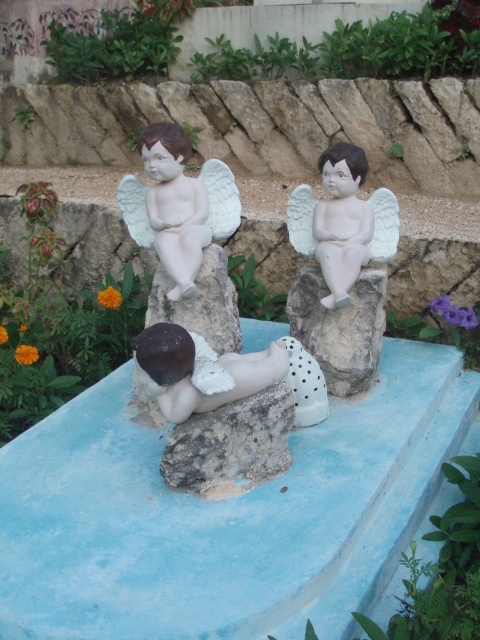
You are a sculptor examining the decorative arrangement. You need to determine if the white matte angel at center can be placed on top of the gray rough stone at center without exceeding its base. Based on their sizes, is this feasible?

The white matte angel at center has a larger size compared to gray rough stone at center, so placing it on top would not be feasible as the angel is bigger than the stone base.

You are a landscape architect designing a garden pathway. You need to place a new decorative stone near the white matte angel at center and the white matte stone at upper right. Based on their current positions, which object is positioned higher up in the scene?

The white matte angel at center is located above the white matte stone at upper right, so the white matte angel at center is positioned higher up in the scene.

You are standing at the origin point of the coordinate system in this garden scene. The white matte angel at center is located at point 0.347, 0.715. If you want to walk directly to it, which direction should you head?

You should head towards the coordinates (343, 221) to reach the white matte angel at center.